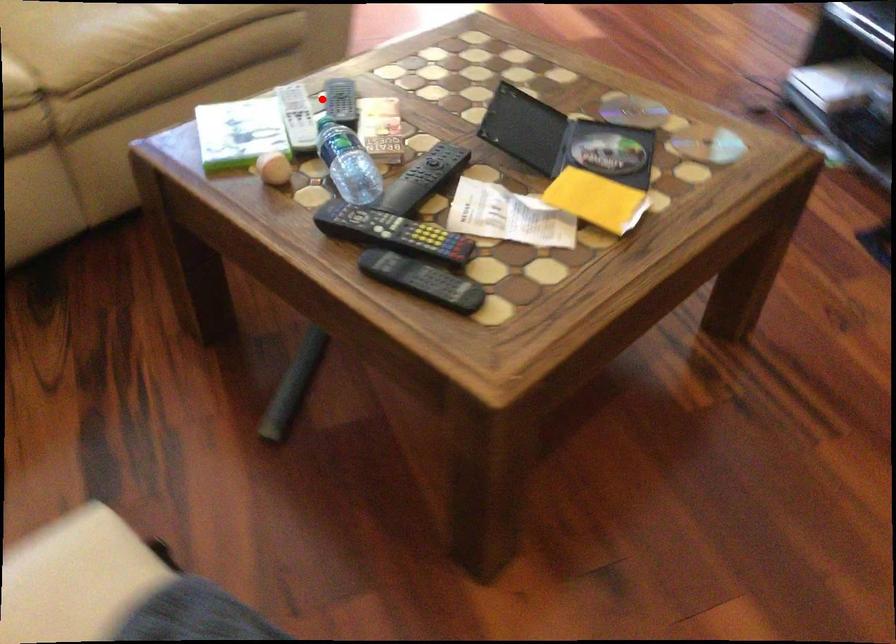
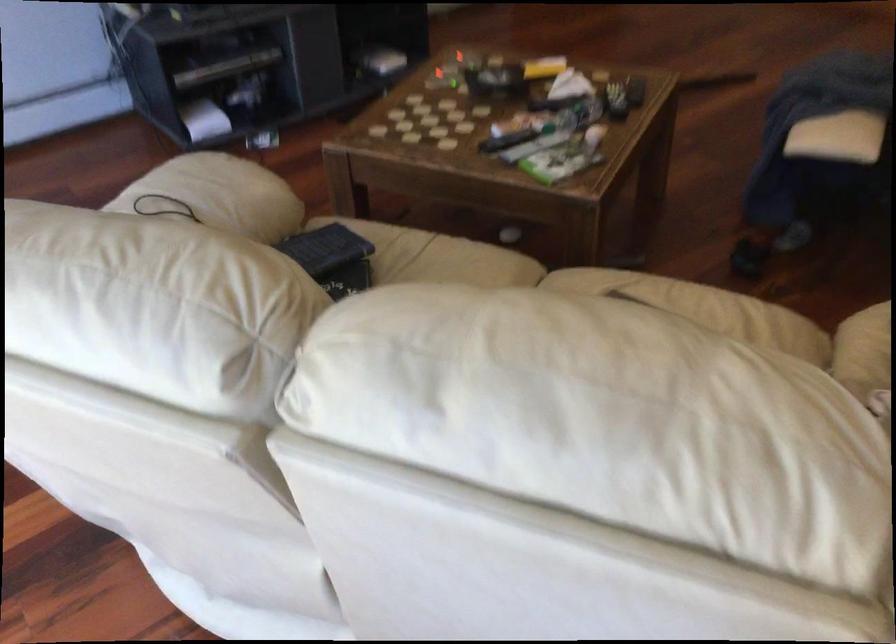
Question: I am providing you with two images of the same scene from different viewpoints. A red point is shown in image1. For the corresponding object point in image2, is it positioned nearer or farther from the camera?

Choices:
 (A) Nearer
 (B) Farther

Answer: (B)